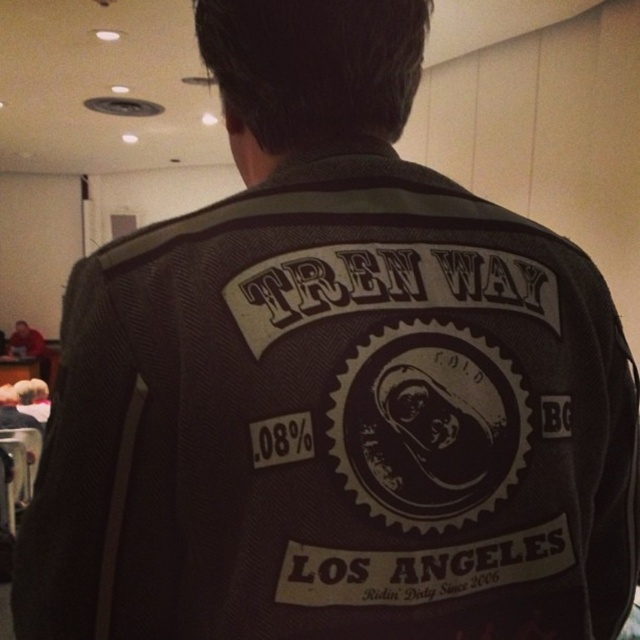
You are a tailor measuring a jacket patch for a client. The client wants to know if the distance between the point at (372, 481) and the bottom left corner of the .08 text is less than 40 centimeters. Based on the image, what is your assessment?

The distance between the point at (372, 481) and the bottom left corner of the .08 text is 41.35 centimeters, which is more than 40 centimeters. Therefore, the distance is not less than 40 centimeters.

You are a tailor who needs to place a black matte patch at center onto a red leather jacket at lower left. Given their sizes, will the patch fit without overlapping the jacket edges?

The black matte patch at center is smaller than the red leather jacket at lower left, so it will fit without overlapping the jacket edges.